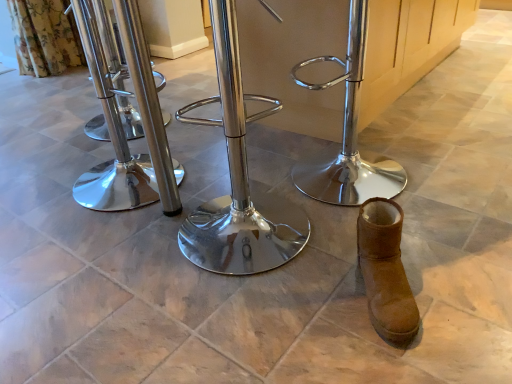
This screenshot has height=384, width=512. Find the location of `vacant area located to the right-hand side of polished metal swivel chair at center, which appears as the 2th swivel chair when viewed from the left`. vacant area located to the right-hand side of polished metal swivel chair at center, which appears as the 2th swivel chair when viewed from the left is located at coordinates (356, 243).